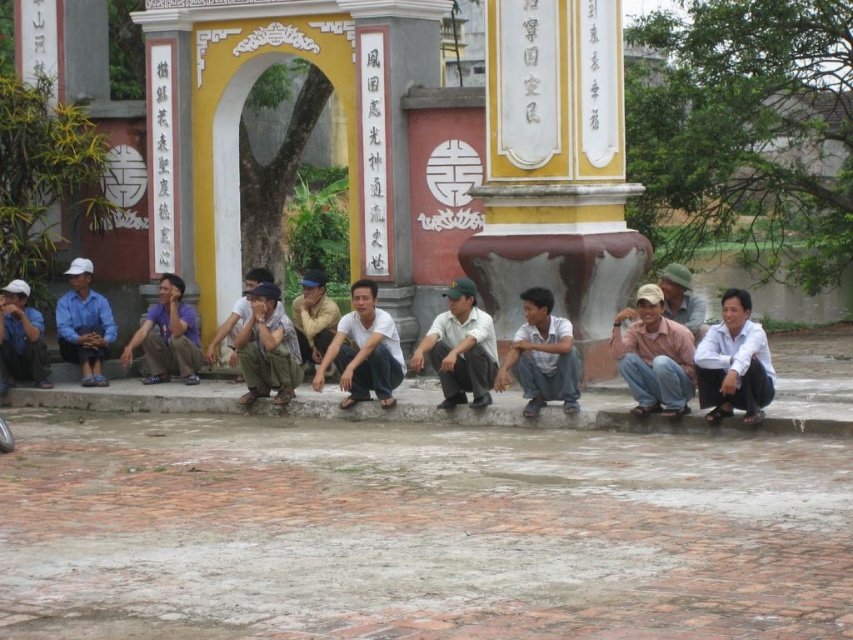
Question: Does purple cotton shirt at center appear over light brown cap at center?

Choices:
 (A) yes
 (B) no

Answer: (B)

Question: Can you confirm if white matte shirt at lower right is positioned above khaki pants at center?

Choices:
 (A) no
 (B) yes

Answer: (B)

Question: Is white matte uniform at center thinner than white cotton shirt at center?

Choices:
 (A) no
 (B) yes

Answer: (B)

Question: Which object is the closest to the brown cotton shirt at center?

Choices:
 (A) matte blue shirt at left
 (B) white matte uniform at center
 (C) khaki pants at center

Answer: (B)

Question: Based on their relative distances, which object is nearer to the matte blue shirt at left?

Choices:
 (A) white matte shirt at lower right
 (B) purple cotton shirt at center
 (C) white matte uniform at center

Answer: (B)

Question: Which object is closer to the camera taking this photo?

Choices:
 (A) brown cotton shirt at center
 (B) matte blue shirt at left

Answer: (A)